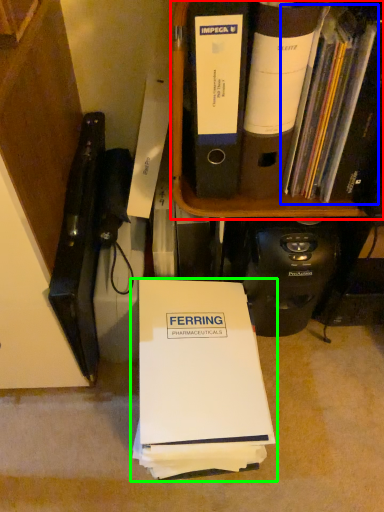
Question: Considering the real-world distances, which object is closest to bookcase (highlighted by a red box)? book (highlighted by a blue box) or book (highlighted by a green box).

Choices:
 (A) book
 (B) book

Answer: (A)